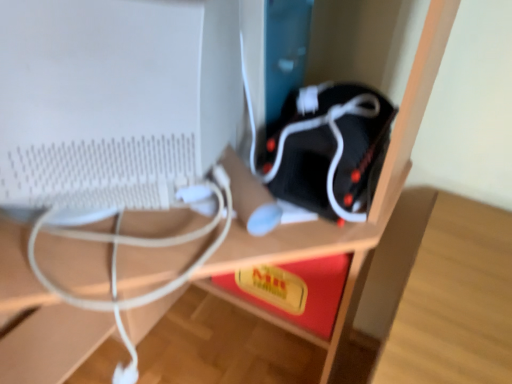
Question: From their relative heights in the image, would you say white matte computer monitor at left is taller or shorter than black matte speaker at center?

Choices:
 (A) tall
 (B) short

Answer: (A)

Question: From the image's perspective, is white matte computer monitor at left above or below black matte speaker at center?

Choices:
 (A) above
 (B) below

Answer: (A)

Question: Based on their sizes in the image, would you say white matte computer monitor at left is bigger or smaller than black matte speaker at center?

Choices:
 (A) big
 (B) small

Answer: (A)

Question: In terms of size, does black matte speaker at center appear bigger or smaller than white matte computer monitor at left?

Choices:
 (A) big
 (B) small

Answer: (B)

Question: Considering the positions of point (379, 163) and point (141, 195), is point (379, 163) closer or farther from the camera than point (141, 195)?

Choices:
 (A) closer
 (B) farther

Answer: (B)

Question: In the image, is black matte speaker at center positioned in front of or behind white matte computer monitor at left?

Choices:
 (A) front
 (B) behind

Answer: (B)

Question: From the image's perspective, is black matte speaker at center positioned above or below white matte computer monitor at left?

Choices:
 (A) above
 (B) below

Answer: (B)